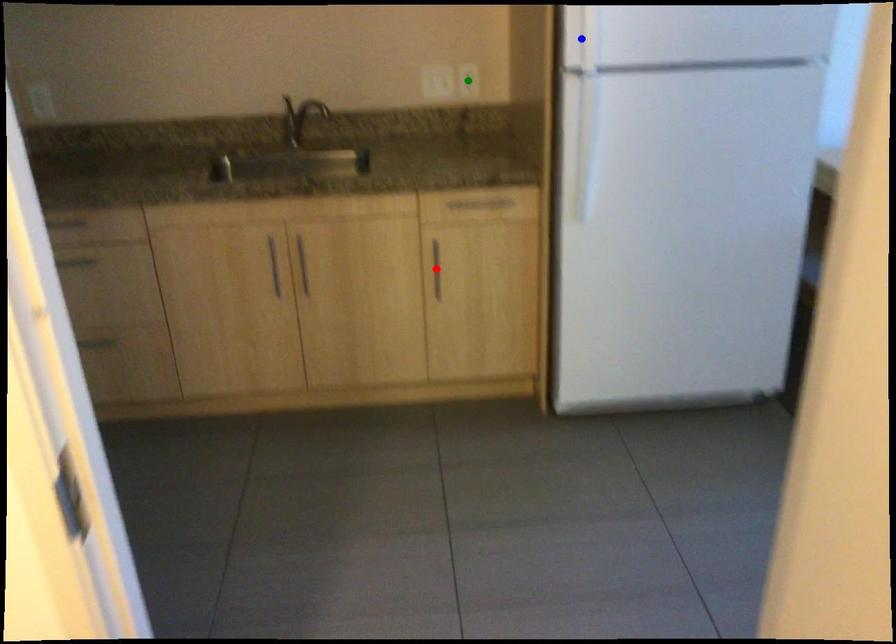
From the picture: Order these from nearest to farthest:
1. blue point
2. green point
3. red point

green point
red point
blue point